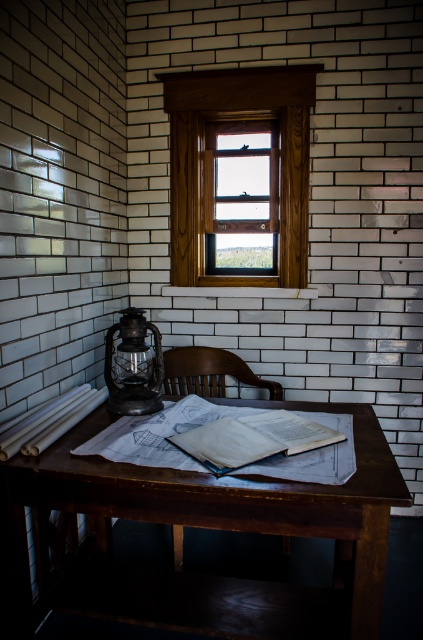
Question: Which of the following is the farthest from the observer?

Choices:
 (A) wooden chair at center
 (B) wooden window at center
 (C) brown wooden chair at center
 (D) white paper book at center

Answer: (B)

Question: Which point appears farthest from the camera in this image?

Choices:
 (A) (189, 387)
 (B) (216, 444)
 (C) (203, 93)
 (D) (134, 372)

Answer: (A)

Question: Which point is closer to the camera?

Choices:
 (A) (275, 609)
 (B) (200, 355)
 (C) (291, 109)

Answer: (A)

Question: Does wooden window at center have a larger size compared to white paper book at center?

Choices:
 (A) yes
 (B) no

Answer: (A)

Question: Does matte black lantern at left appear on the right side of brown wooden chair at center?

Choices:
 (A) no
 (B) yes

Answer: (A)

Question: Can you confirm if wooden chair at center is positioned below brown wooden chair at center?

Choices:
 (A) yes
 (B) no

Answer: (B)